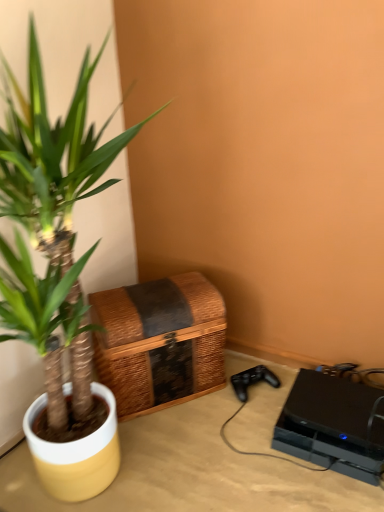
Locate an element on the screen. blank space situated above woven brown basket at lower left (from a real-world perspective) is located at coordinates (148, 294).